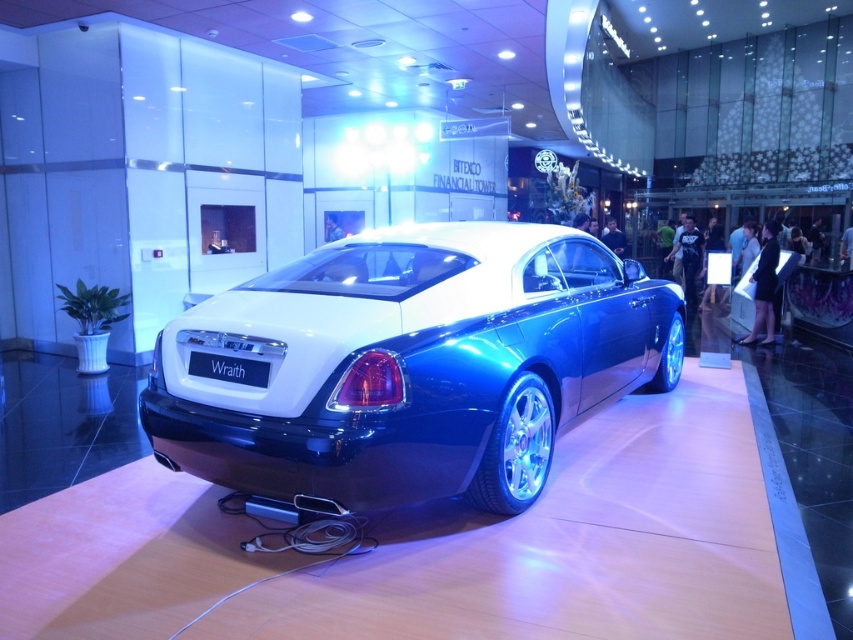
Question: Is metallic blue car at center smaller than black matte license plate at rear?

Choices:
 (A) no
 (B) yes

Answer: (A)

Question: Which of the following is the closest to the observer?

Choices:
 (A) metallic blue car at center
 (B) black matte license plate at rear

Answer: (A)

Question: Is metallic blue car at center in front of black matte license plate at rear?

Choices:
 (A) no
 (B) yes

Answer: (B)

Question: From the image, what is the correct spatial relationship of metallic blue car at center in relation to black matte license plate at rear?

Choices:
 (A) left
 (B) right

Answer: (B)

Question: Which point is closer to the camera?

Choices:
 (A) (247, 378)
 (B) (679, 342)

Answer: (A)